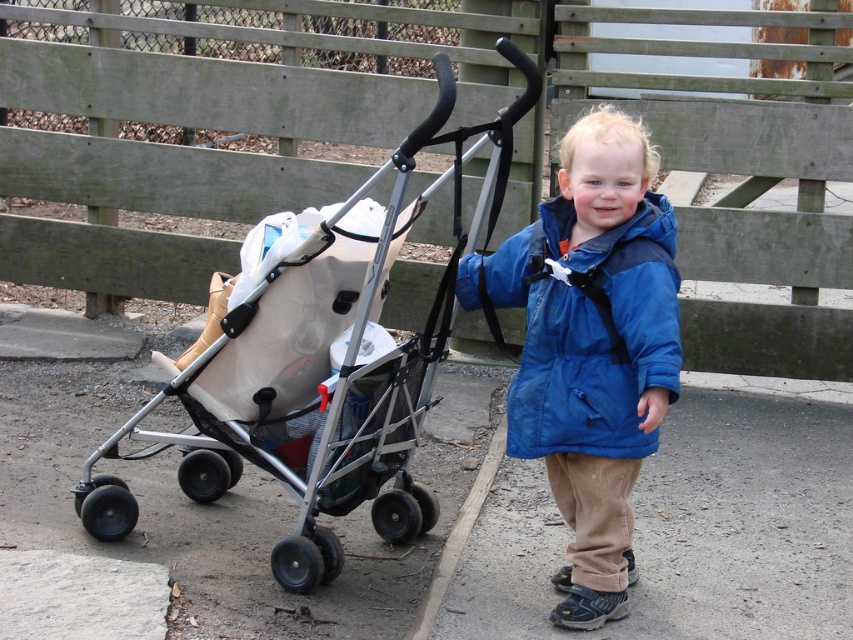
You are a photographer trying to capture the silver metallic stroller at left and the brown asphalt at lower right in your shot. Which object will appear larger in the photo?

The silver metallic stroller at left will appear larger in the photo because it is closer to the viewer than the brown asphalt at lower right.

You are a delivery robot that needs to place a package in the stroller. The robot is 2 feet wide. Can you fit between the silver metallic stroller at left and the brown asphalt at lower right to reach the stroller?

The distance between the silver metallic stroller at left and the brown asphalt at lower right is 3.71 feet. Since the robot is 2 feet wide, it can fit through the space as 3.71 feet is wider than 2 feet.